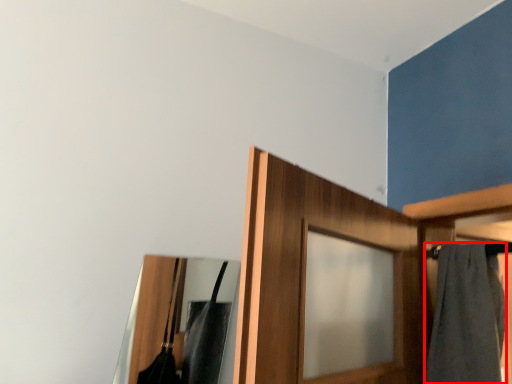
Question: Observing the image, what is the correct spatial positioning of bath towel (annotated by the red box) in reference to mirror?

Choices:
 (A) right
 (B) left

Answer: (A)